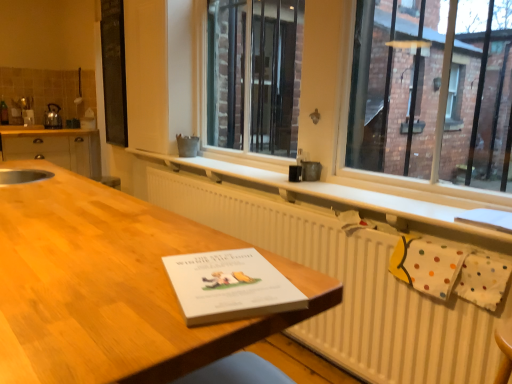
Question: From the image's perspective, is metallic silver kettle at left under white textured radiator at center?

Choices:
 (A) yes
 (B) no

Answer: (B)

Question: Is metallic silver kettle at left thinner than white textured radiator at center?

Choices:
 (A) yes
 (B) no

Answer: (B)

Question: From a real-world perspective, is metallic silver kettle at left positioned under white textured radiator at center based on gravity?

Choices:
 (A) no
 (B) yes

Answer: (A)

Question: Is the depth of metallic silver kettle at left greater than that of white textured radiator at center?

Choices:
 (A) no
 (B) yes

Answer: (B)

Question: Is metallic silver kettle at left positioned in front of white textured radiator at center?

Choices:
 (A) yes
 (B) no

Answer: (B)

Question: From a real-world perspective, is wooden table at center positioned above or below matte wood cabinets at left?

Choices:
 (A) below
 (B) above

Answer: (A)

Question: Considering the relative positions of wooden table at center and matte wood cabinets at left in the image provided, is wooden table at center to the left or to the right of matte wood cabinets at left?

Choices:
 (A) left
 (B) right

Answer: (B)

Question: Considering the positions of wooden table at center and matte wood cabinets at left in the image, is wooden table at center taller or shorter than matte wood cabinets at left?

Choices:
 (A) short
 (B) tall

Answer: (B)

Question: Do you think wooden table at center is within matte wood cabinets at left, or outside of it?

Choices:
 (A) inside
 (B) outside

Answer: (B)

Question: Is wooden table at center in front of or behind white paper at center in the image?

Choices:
 (A) behind
 (B) front

Answer: (B)

Question: Is point coord(126,276) positioned closer to the camera than point coord(207,304)?

Choices:
 (A) farther
 (B) closer

Answer: (A)

Question: In the image, is wooden table at center on the left side or the right side of white paper at center?

Choices:
 (A) right
 (B) left

Answer: (B)

Question: Is wooden table at center situated inside white paper at center or outside?

Choices:
 (A) outside
 (B) inside

Answer: (A)

Question: Is matte wood cabinets at left spatially inside clear glass window at center, or outside of it?

Choices:
 (A) outside
 (B) inside

Answer: (A)

Question: Considering the positions of point (96, 163) and point (423, 21), is point (96, 163) closer or farther from the camera than point (423, 21)?

Choices:
 (A) farther
 (B) closer

Answer: (A)